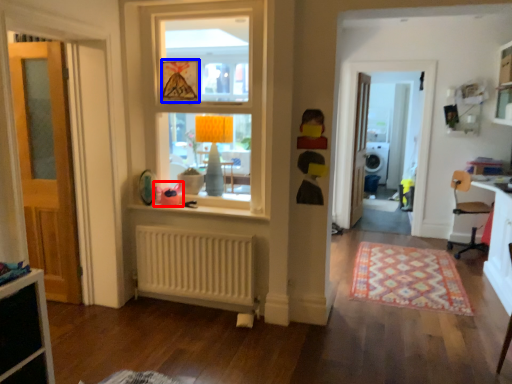
Question: Which point is closer to the camera, toy (highlighted by a red box) or picture frame (highlighted by a blue box)?

Choices:
 (A) toy
 (B) picture frame

Answer: (B)